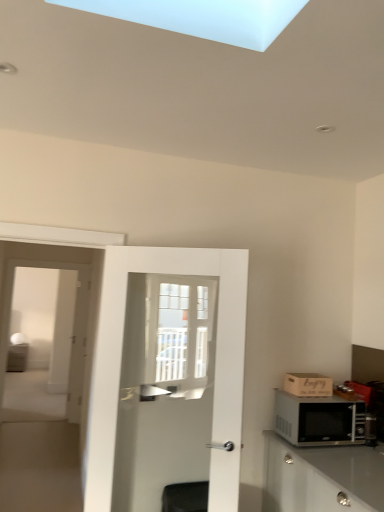
Question: In terms of height, does matte white cabinet at left look taller or shorter compared to black metallic microwave at right?

Choices:
 (A) tall
 (B) short

Answer: (A)

Question: From a real-world perspective, relative to black metallic microwave at right, is matte white cabinet at left vertically above or below?

Choices:
 (A) below
 (B) above

Answer: (A)

Question: Based on their relative distances, which object is nearer to the black metallic microwave at right?

Choices:
 (A) wooden crate at right
 (B) white glossy door at center
 (C) white glass screen door at left
 (D) matte white cabinet at left

Answer: (A)

Question: Which of these objects is positioned closest to the white glossy door at center?

Choices:
 (A) black metallic microwave at right
 (B) wooden crate at right
 (C) white glass screen door at left
 (D) matte white cabinet at left

Answer: (A)